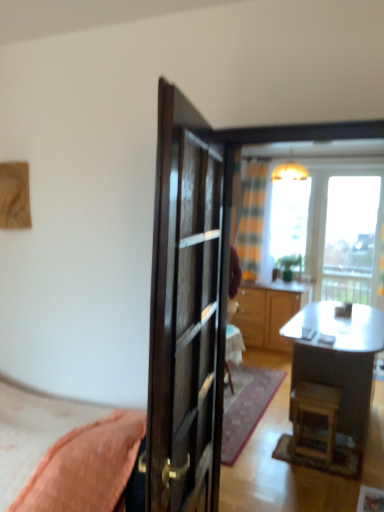
This screenshot has height=512, width=384. In order to click on metallic silver desk at center in this screenshot , I will do `click(331, 385)`.

Measure the distance between wooden cabinet at center and camera.

A distance of 16.06 feet exists between wooden cabinet at center and camera.

Describe the element at coordinates (269, 312) in the screenshot. I see `wooden cabinet at center` at that location.

Describe the element at coordinates (352, 237) in the screenshot. I see `transparent glass window at upper right` at that location.

Image resolution: width=384 pixels, height=512 pixels. Identify the location of matte yellow lampshade at upper center. (290, 172).

Where is `metallic silver desk at center`? metallic silver desk at center is located at coordinates (331, 385).

From the image's perspective, between wooden cabinet at center and wooden terrace at center, which one is located above?

wooden terrace at center, from the image's perspective.

Could you tell me if wooden cabinet at center is facing wooden terrace at center?

Yes, wooden cabinet at center is aimed at wooden terrace at center.

Considering their positions, is wooden cabinet at center located in front of or behind wooden terrace at center?

In the image, wooden cabinet at center appears behind wooden terrace at center.

Looking at this image, is wooden terrace at center located within wooden cabinet at center?

No, wooden terrace at center is not inside wooden cabinet at center.

From a real-world perspective, is transparent glass window at upper center positioned above or below plaid fabric curtain at center?

Clearly, from a real-world perspective, transparent glass window at upper center is below plaid fabric curtain at center.

Is plaid fabric curtain at center surrounded by transparent glass window at upper center?

Actually, plaid fabric curtain at center is outside transparent glass window at upper center.

Between transparent glass window at upper center and plaid fabric curtain at center, which one is positioned in front?

plaid fabric curtain at center.

Are transparent glass window at upper center and plaid fabric curtain at center far apart?

No, there isn't a large distance between transparent glass window at upper center and plaid fabric curtain at center.

Find the location of a particular element. desk beneath the glossy dark wood door at center (from a real-world perspective) is located at coordinates (331, 385).

Can you confirm if glossy dark wood door at center is positioned to the left of metallic silver desk at center?

Yes.

Is glossy dark wood door at center facing towards metallic silver desk at center?

No, glossy dark wood door at center is not turned towards metallic silver desk at center.

How much distance is there between glossy dark wood door at center and metallic silver desk at center?

A distance of 4.16 feet exists between glossy dark wood door at center and metallic silver desk at center.

Does plaid fabric curtain at center have a greater height compared to wooden cabinet at center?

Correct, plaid fabric curtain at center is much taller as wooden cabinet at center.

Does plaid fabric curtain at center have a greater width compared to wooden cabinet at center?

No, plaid fabric curtain at center is not wider than wooden cabinet at center.

From a real-world perspective, is plaid fabric curtain at center positioned over wooden cabinet at center based on gravity?

Yes, from a real-world perspective, plaid fabric curtain at center is above wooden cabinet at center.

Does plaid fabric curtain at center touch wooden cabinet at center?

No.

Identify the location of stool on the right of matte yellow lampshade at upper center. (315, 414).

Is matte yellow lampshade at upper center outside of wooden stool at lower right?

Yes.

Can you confirm if matte yellow lampshade at upper center is thinner than wooden stool at lower right?

No.

From a real-world perspective, is wooden terrace at center below metallic silver desk at center?

Incorrect, from a real-world perspective, wooden terrace at center is higher than metallic silver desk at center.

Is wooden terrace at center next to metallic silver desk at center and touching it?

Yes, wooden terrace at center is next to metallic silver desk at center.

Based on the photo, is wooden terrace at center completely or partially outside of metallic silver desk at center?

Yes, wooden terrace at center is located beyond the bounds of metallic silver desk at center.

Between wooden cabinet at center and wooden stool at lower right, which one has less height?

With less height is wooden stool at lower right.

Considering the relative positions of wooden cabinet at center and wooden stool at lower right in the image provided, is wooden cabinet at center behind wooden stool at lower right?

Yes, it is.

Is wooden cabinet at center facing away from wooden stool at lower right?

No, wooden stool at lower right is not at the back of wooden cabinet at center.

Which of these two, wooden cabinet at center or wooden stool at lower right, is thinner?

wooden stool at lower right.

The image size is (384, 512). What are the coordinates of `terrace above the wooden cabinet at center (from a real-world perspective)` in the screenshot? It's located at (320, 347).

At what (x,y) coordinates should I click in order to perform the action: click on window screen beneath the plaid fabric curtain at center (from a real-world perspective). Please return your answer as a coordinate pair (x, y). Looking at the image, I should click on (285, 226).

Which object lies nearer to the anchor point transparent glass window at upper center, wooden cabinet at center or green matte houseplant at center?

green matte houseplant at center is closer to transparent glass window at upper center.

Which object lies further to the anchor point wooden cabinet at center, wooden stool at lower right or matte yellow lampshade at upper center?

wooden stool at lower right lies further to wooden cabinet at center than the other object.

Looking at this image, when comparing their distances from metallic silver desk at center, does green matte houseplant at center or transparent glass window at upper center seem further?

green matte houseplant at center is positioned further to the anchor metallic silver desk at center.

Which object lies further to the anchor point transparent glass window at upper right, wooden cabinet at center or transparent glass window at upper center?

wooden cabinet at center.

Considering their positions, is wooden cabinet at center positioned further to transparent glass window at upper right than plaid fabric curtain at center?

plaid fabric curtain at center.

When comparing their distances from plaid fabric curtain at center, does transparent glass window at upper right or wooden cabinet at center seem closer?

wooden cabinet at center is closer to plaid fabric curtain at center.

Considering their positions, is wooden terrace at center positioned further to metallic silver desk at center than matte yellow lampshade at upper center?

Based on the image, matte yellow lampshade at upper center appears to be further to metallic silver desk at center.

Based on their spatial positions, is wooden stool at lower right or transparent glass window at upper right further from metallic silver desk at center?

Based on the image, transparent glass window at upper right appears to be further to metallic silver desk at center.

I want to click on stool between glossy dark wood door at center and transparent glass window at upper right in the front-back direction, so click(315, 414).

Find the location of a particular element. window between wooden stool at lower right and transparent glass window at upper center along the z-axis is located at coordinates (352, 237).

Where is `lamp positioned between glossy dark wood door at center and plaid fabric curtain at center from near to far`? This screenshot has width=384, height=512. lamp positioned between glossy dark wood door at center and plaid fabric curtain at center from near to far is located at coordinates (290, 172).

Locate an element on the screen. This screenshot has width=384, height=512. lamp located between metallic silver desk at center and green matte houseplant at center in the depth direction is located at coordinates (290, 172).